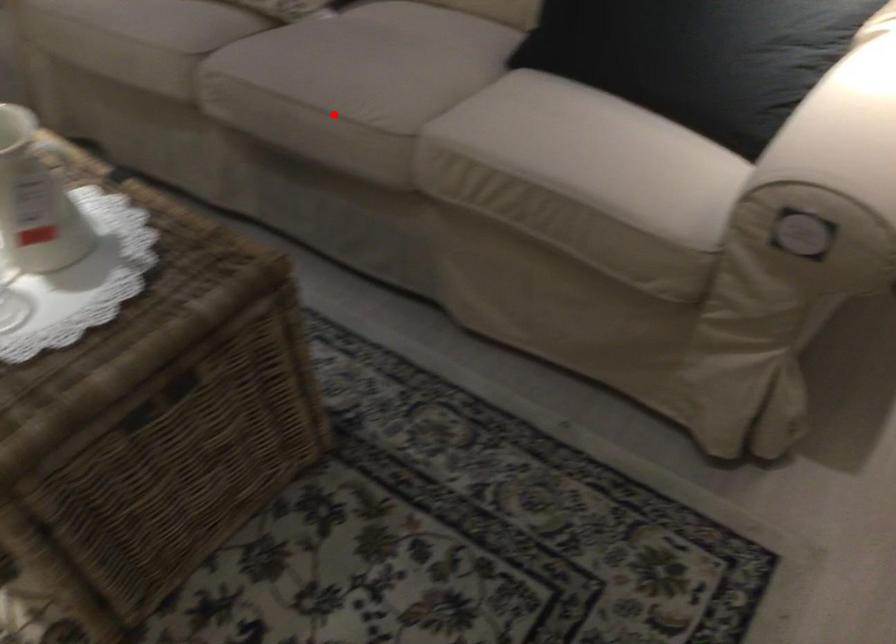
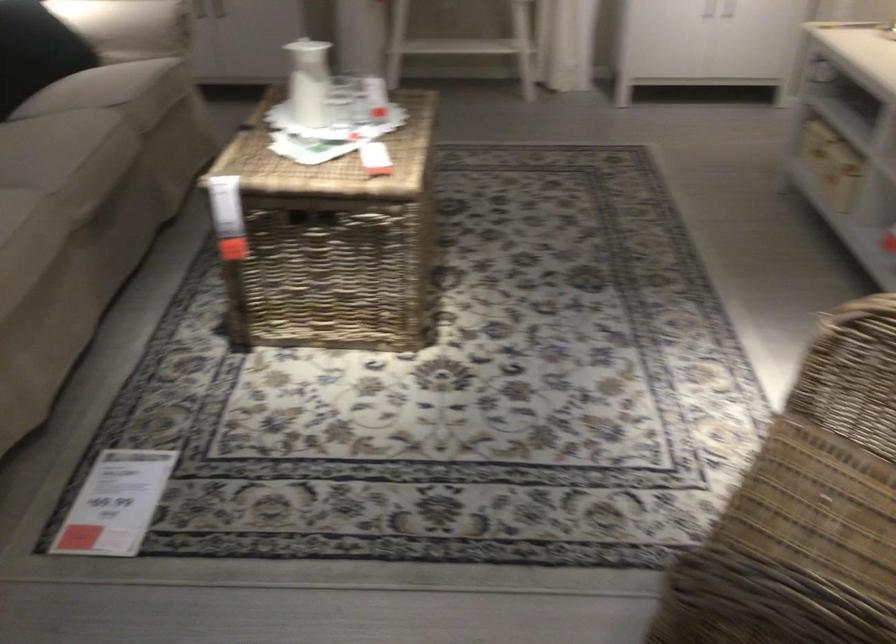
Question: I am providing you with two images of the same scene from different viewpoints. In image1, a red point is highlighted. Considering the same 3D point in image2, which of the following is correct?

Choices:
 (A) It is closer
 (B) It is farther

Answer: (B)